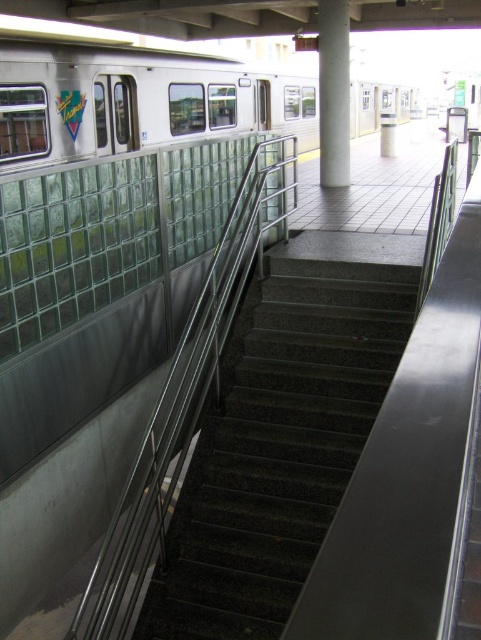
You are waiting at the transit station platform and need to board the silver metallic train at upper left. However, there is a white glossy pillar at upper center blocking your path. Can you walk around the pillar to reach the train?

The silver metallic train at upper left is much taller than the white glossy pillar at upper center, so you can walk around the pillar since it is shorter and won

You are a maintenance worker on the platform and need to reach the lower level. The granite stairs at center leads down, but there is a silver metallic train at upper left approaching. Considering their heights, which one should you prioritize to avoid being blocked?

The granite stairs at center is shorter than the silver metallic train at upper left. Therefore, you should prioritize moving towards the silver metallic train at upper left to avoid being blocked by the taller object.

You are standing at the platform level of the transit station and want to go down to the lower level. Which object at point (278, 445) should you use?

The point (278, 445) corresponds to the granite stairs at center, so you should use the granite stairs at center to go down to the lower level.